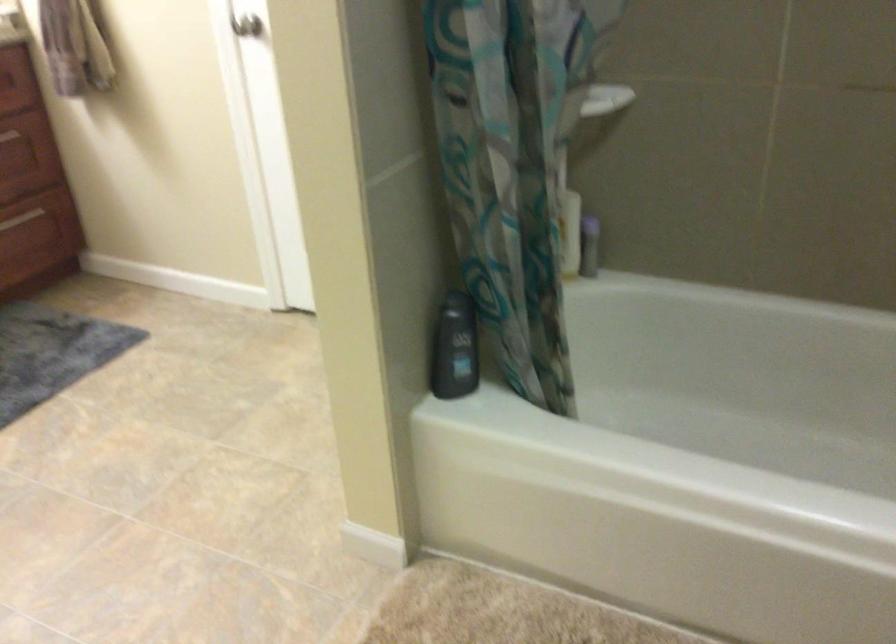
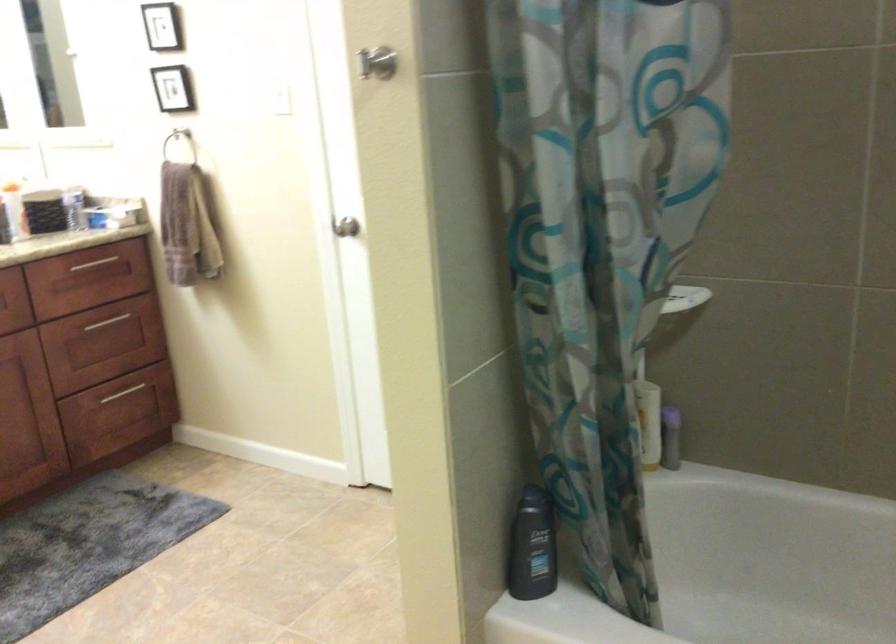
Question: How did the camera likely rotate?

Choices:
 (A) Left
 (B) Right
 (C) Up
 (D) Down

Answer: (C)